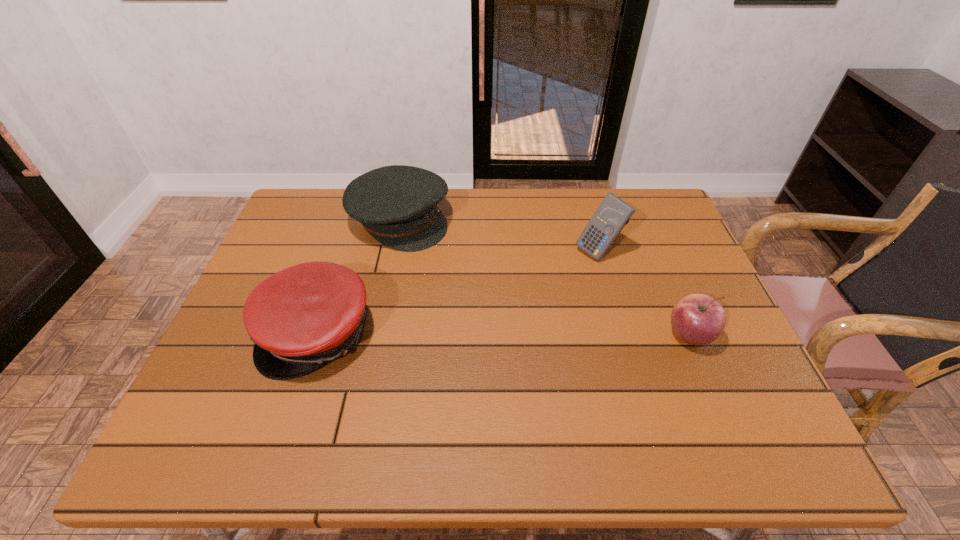
Identify the location of cap. The image size is (960, 540). (300, 318).

Image resolution: width=960 pixels, height=540 pixels. What are the coordinates of `the rightmost object` in the screenshot? It's located at (697, 319).

This screenshot has width=960, height=540. Find the location of `beret`. beret is located at coordinates (397, 205).

This screenshot has width=960, height=540. Find the location of `the tallest object`. the tallest object is located at coordinates (613, 213).

The height and width of the screenshot is (540, 960). I want to click on calculator, so click(x=613, y=213).

Identify the location of vacant space situated at the front of the cap where the visor is located. This screenshot has width=960, height=540. (296, 402).

I want to click on blank space located 0.270m on the left of the apple, so click(556, 336).

The height and width of the screenshot is (540, 960). In order to click on vacant area situated on the front-facing side of the beret in this screenshot , I will do `click(452, 258)`.

Locate an element on the screen. vacant area located 0.190m on the front-facing side of the beret is located at coordinates (476, 275).

This screenshot has height=540, width=960. In order to click on free space located on the front-facing side of the beret in this screenshot , I will do click(513, 302).